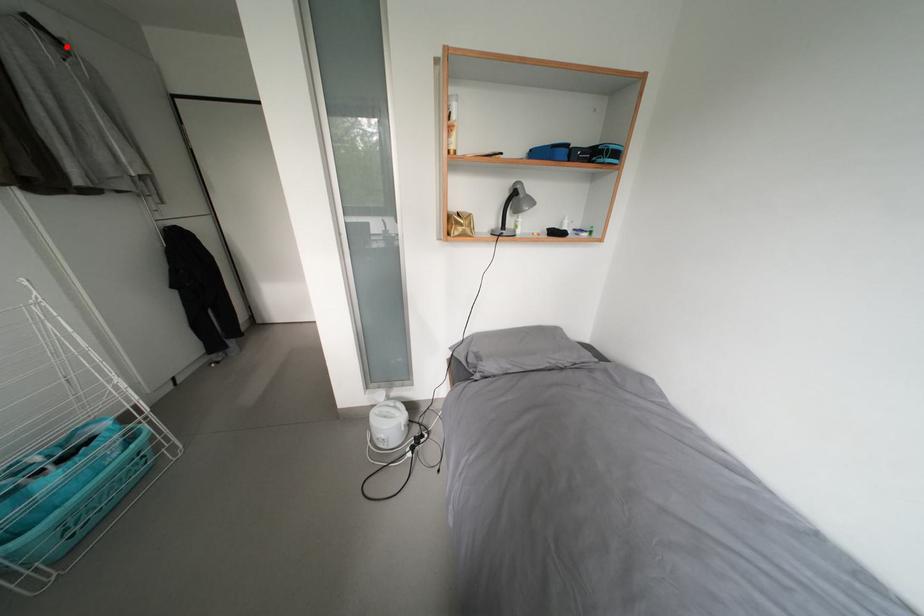
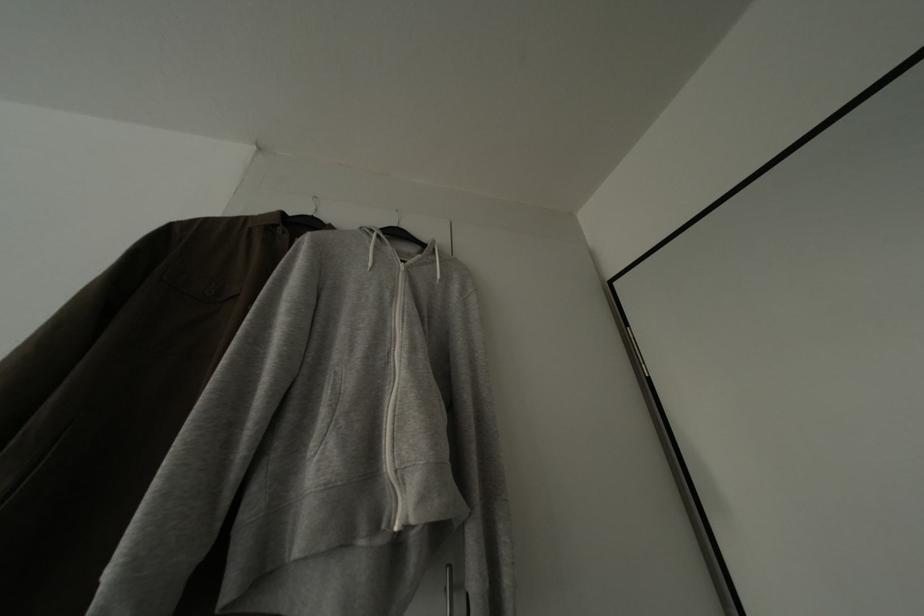
In the second image, find the point that corresponds to the highlighted location in the first image.

(431, 252)